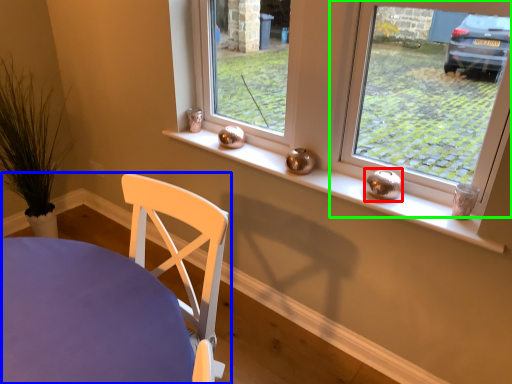
Question: Based on their relative distances, which object is farther from candle holder (highlighted by a red box)? Choose from chair (highlighted by a blue box) and window (highlighted by a green box).

Choices:
 (A) chair
 (B) window

Answer: (B)